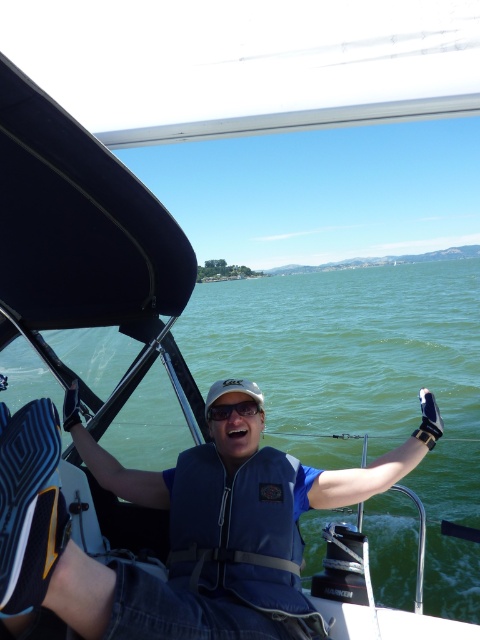
You are a safety inspector checking the equipment of the person on the sailboat. You need to ensure that the blue fabric life jacket at center and the matte black goggles at center are properly sized for the person. Based on the image, which of these items has a larger width?

The blue fabric life jacket at center has a larger width than the matte black goggles at center according to the description.

You are navigating a small boat and need to determine the closest point to your current position. You observe two points marked in the scene. Which point, point 1 at coordinates point (195, 566) or point 2 at coordinates point (248, 404), is closer to you?

Point 1 at coordinates point (195, 566) is closer to the viewer than point 2 at coordinates point (248, 404).